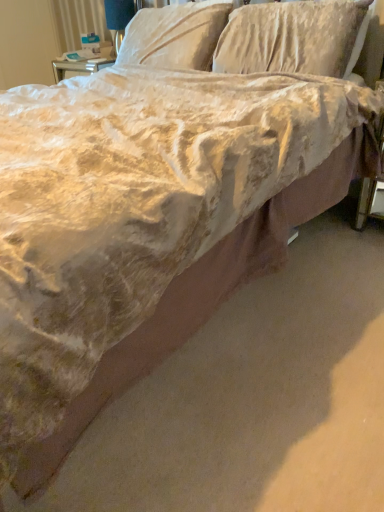
Question: Considering the positions of velvet-like beige pillow at upper center, which is counted as the 1th pillow, starting from the left, and velvet-like beige pillow at upper center, the 1th pillow when ordered from right to left, in the image, is velvet-like beige pillow at upper center, which is counted as the 1th pillow, starting from the left, bigger or smaller than velvet-like beige pillow at upper center, the 1th pillow when ordered from right to left,?

Choices:
 (A) small
 (B) big

Answer: (A)

Question: In the image, is velvet-like beige pillow at upper center, which is counted as the 1th pillow, starting from the left, positioned in front of or behind velvet-like beige pillow at upper center, the second pillow positioned from the left?

Choices:
 (A) front
 (B) behind

Answer: (B)

Question: Which of these objects is positioned closest to the velvet-like beige pillow at upper center, acting as the second pillow starting from the right?

Choices:
 (A) velvet-like beige pillow at upper center, the 1th pillow when ordered from right to left
 (B) matte white table lamp at upper center

Answer: (A)

Question: Which object is positioned closest to the velvet-like beige pillow at upper center, the 1th pillow when ordered from right to left?

Choices:
 (A) matte white table lamp at upper center
 (B) velvet-like beige pillow at upper center, acting as the second pillow starting from the right

Answer: (B)